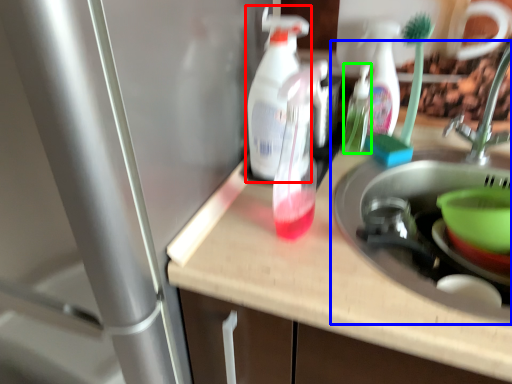
Question: Which object is the farthest from cleaning product (highlighted by a red box)? Choose among these: sink (highlighted by a blue box) or bottle (highlighted by a green box).

Choices:
 (A) sink
 (B) bottle

Answer: (A)